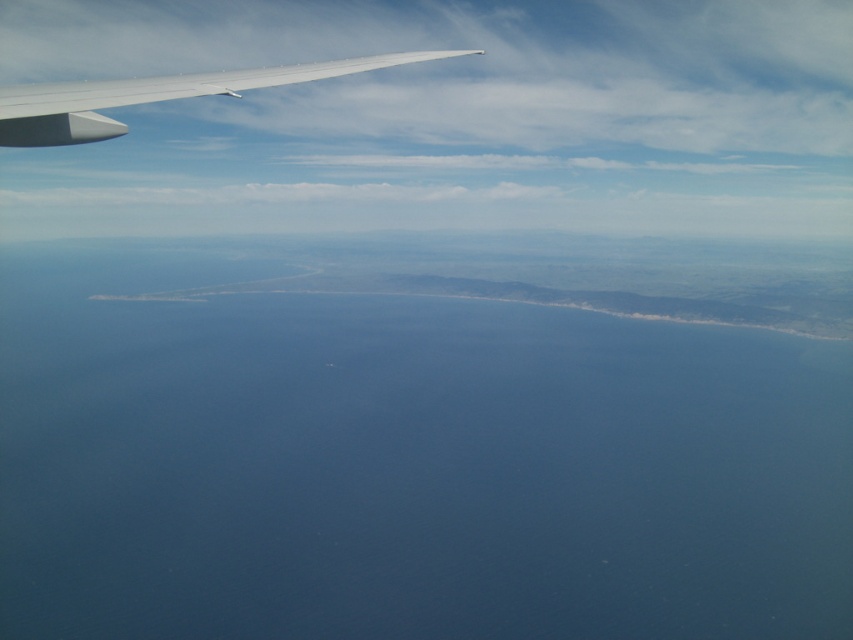
Does blue water at center appear under white matte wing at upper left?

Correct, blue water at center is located below white matte wing at upper left.

Is point (292, 544) more distant than point (178, 77)?

That is True.

At what (x,y) coordinates should I click in order to perform the action: click on blue water at center. Please return your answer as a coordinate pair (x, y). Looking at the image, I should click on (415, 472).